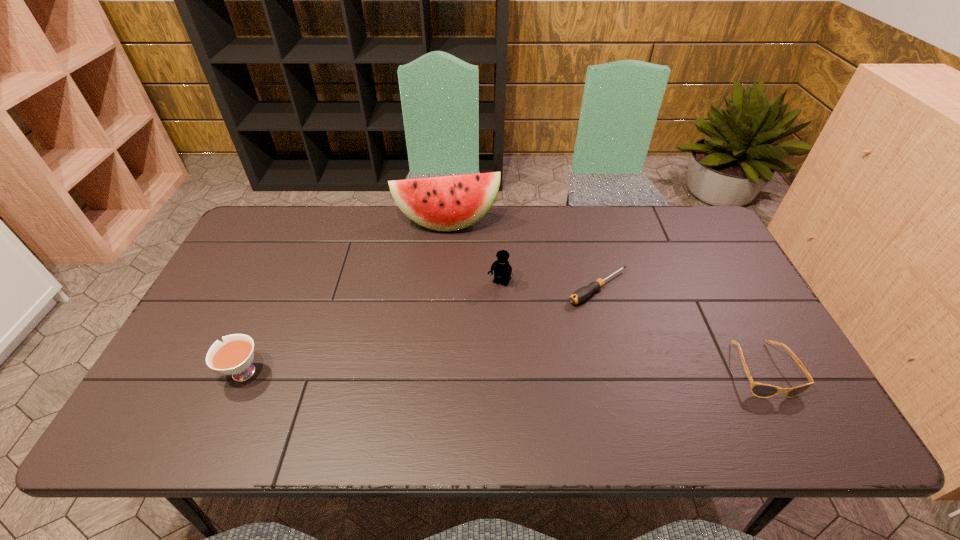
The image size is (960, 540). Identify the location of teacup that is at the near edge. (234, 357).

Locate an element on the screen. sunglasses that is at the near edge is located at coordinates (761, 390).

This screenshot has height=540, width=960. Find the location of `object that is positioned at the left edge`. object that is positioned at the left edge is located at coordinates (234, 357).

Find the location of a particular element. This screenshot has width=960, height=540. object that is at the right edge is located at coordinates pos(761,390).

Locate an element on the screen. object situated at the near left corner is located at coordinates (234, 357).

The width and height of the screenshot is (960, 540). Identify the location of object that is at the near right corner. (761, 390).

Where is `free space at the far edge of the desktop`? This screenshot has height=540, width=960. free space at the far edge of the desktop is located at coordinates (312, 238).

This screenshot has height=540, width=960. What are the coordinates of `vacant space at the near edge` in the screenshot? It's located at tap(465, 394).

Find the location of a particular element. The width and height of the screenshot is (960, 540). blank area at the left edge is located at coordinates (238, 322).

In the image, there is a desktop. Where is `vacant space at the right edge`? vacant space at the right edge is located at coordinates (690, 280).